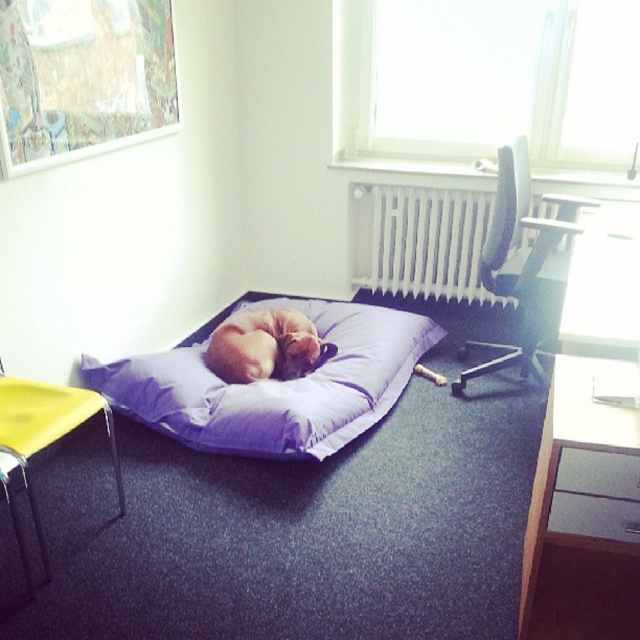
You are a pet owner who wants to place a new small dog bed in this room. You have a choice between a purple fabric sleeping bag at center and a soft beige cat at center. Which one is larger and can accommodate a bigger pet?

The purple fabric sleeping bag at center is bigger than the soft beige cat at center, so it can accommodate a bigger pet.

You are trying to place a new rug in the room. The purple fabric sleeping bag at center is currently at position coordinates point 0.603, 0.430. If the rug is placed at point 0.5, 0.5, will the sleeping bag be directly on top of the rug?

The purple fabric sleeping bag at center is located at point (x=275, y=385), which is slightly to the right and above the rug placed at (x=320, y=320). Therefore, the sleeping bag will not be directly on top of the rug.

You are a pet owner who wants to ensure both your dog and cat have enough space to rest comfortably in the room. Given the scene described, which object is taller between the purple fabric sleeping bag at center and the soft beige cat at center?

The purple fabric sleeping bag at center is much taller than the soft beige cat at center, so the sleeping bag provides more vertical space for the pets.